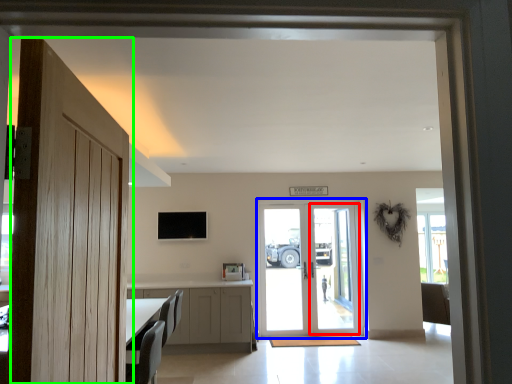
Question: Based on their relative distances, which object is nearer to screen door (highlighted by a red box)? Choose from door (highlighted by a blue box) and door (highlighted by a green box).

Choices:
 (A) door
 (B) door

Answer: (A)